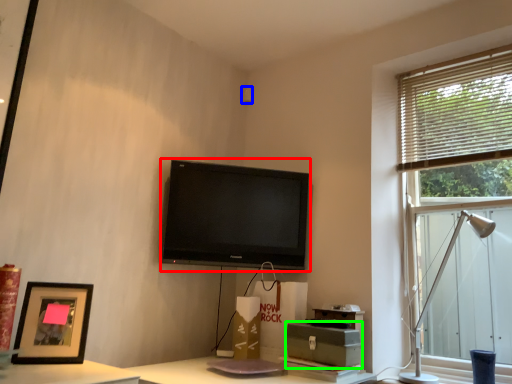
Question: Which object is the closest to the television (highlighted by a red box)? Choose among these: speaker (highlighted by a blue box) or cardboard box (highlighted by a green box).

Choices:
 (A) speaker
 (B) cardboard box

Answer: (B)